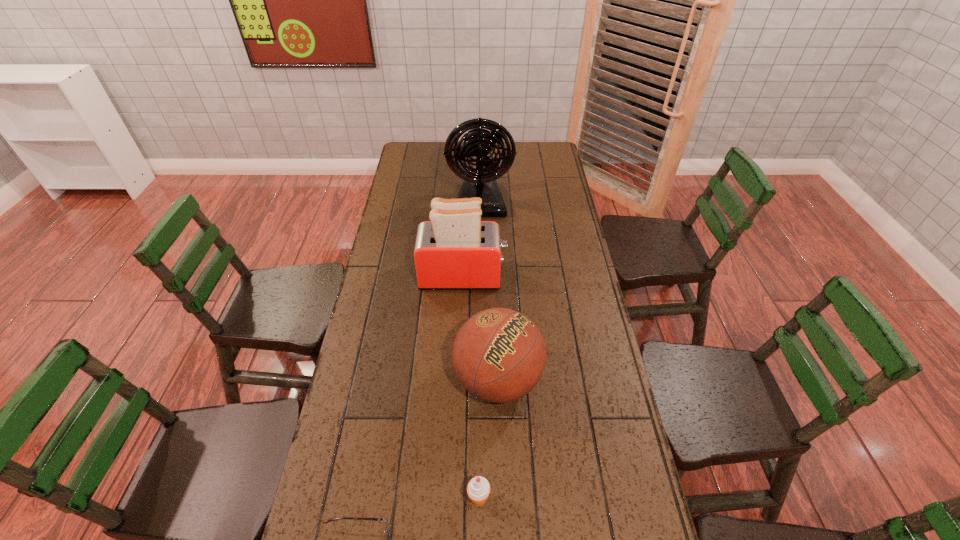
The height and width of the screenshot is (540, 960). I want to click on the tallest object, so click(x=480, y=142).

Where is `the farthest object`? This screenshot has width=960, height=540. the farthest object is located at coordinates (480, 142).

You are a GUI agent. You are given a task and a screenshot of the screen. Output one action in this format:
    pyautogui.click(x=<x>, y=<y>)
    Task: Click on the toaster
    This screenshot has height=540, width=960.
    Given the screenshot: What is the action you would take?
    (x=455, y=250)

At what (x,y) coordinates should I click in order to perform the action: click on the fourth shortest object. Please return your answer as a coordinate pair (x, y). Looking at the image, I should click on (455, 250).

Where is `basketball`? Image resolution: width=960 pixels, height=540 pixels. basketball is located at coordinates (499, 355).

The width and height of the screenshot is (960, 540). I want to click on the third nearest object, so click(499, 355).

Identify the location of icecream. This screenshot has height=540, width=960. tap(478, 489).

Image resolution: width=960 pixels, height=540 pixels. Identify the location of the second nearest object. (478, 489).

Image resolution: width=960 pixels, height=540 pixels. I want to click on vacant space located 0.280m in front of the farthest object to blow air, so click(x=480, y=268).

The height and width of the screenshot is (540, 960). In order to click on free space located 0.200m on the front-facing side of the second farthest object in this screenshot , I will do `click(562, 276)`.